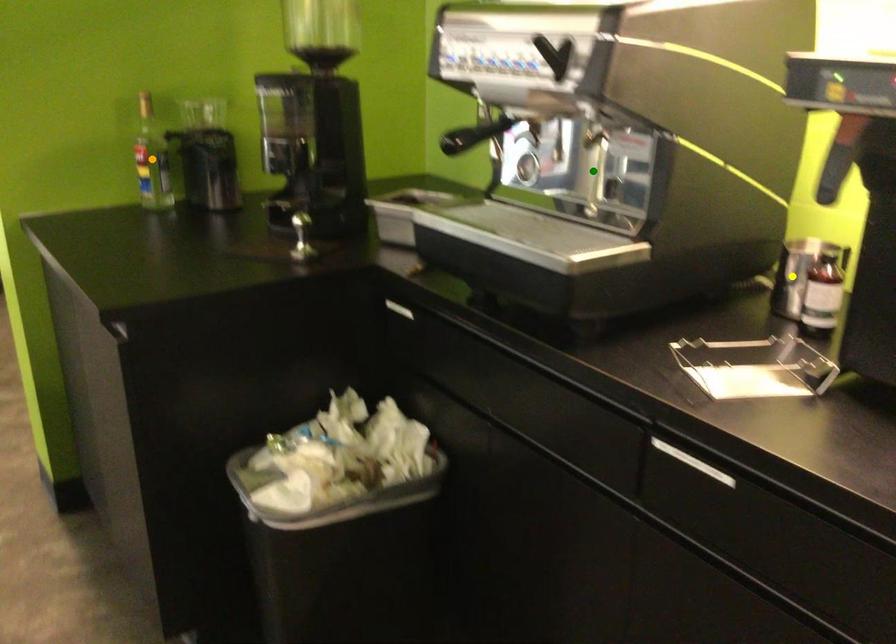
Order these from nearest to farthest:
- green point
- orange point
- yellow point

orange point
yellow point
green point